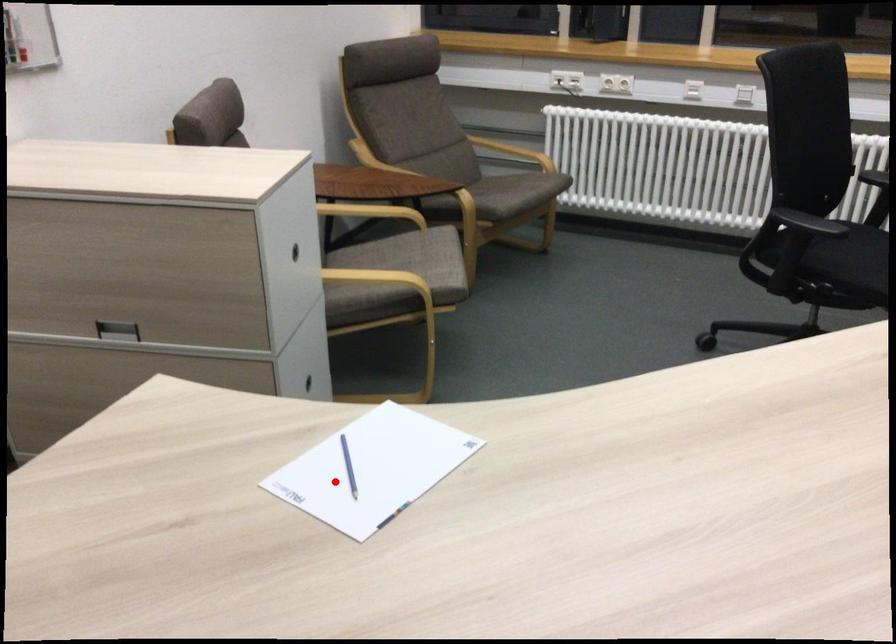
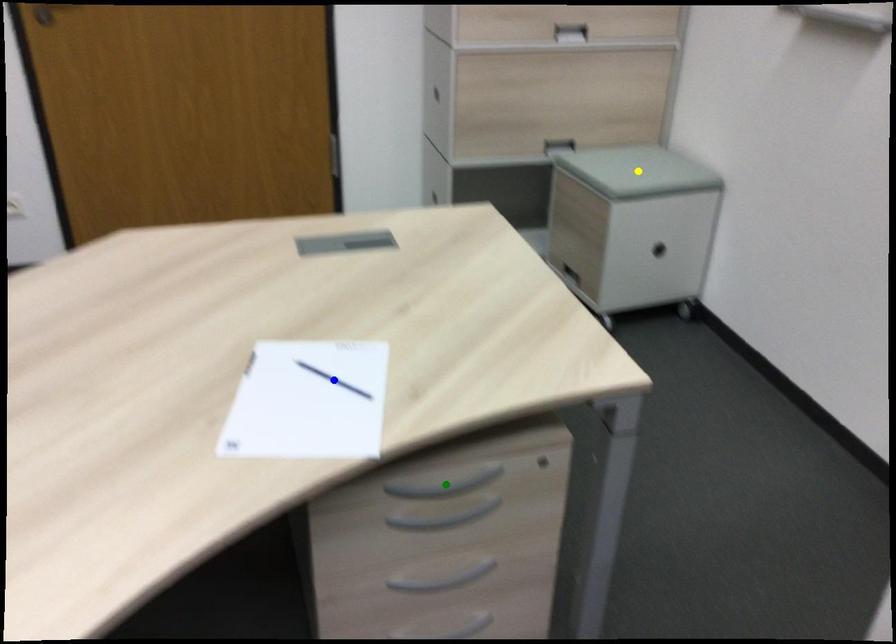
Question: I am providing you with two images of the same scene from different viewpoints. A red point is marked on the first image. You are given multiple points on the second image. Which spot in image 2 lines up with the point in image 1?

Choices:
 (A) yellow point
 (B) blue point
 (C) green point

Answer: (B)